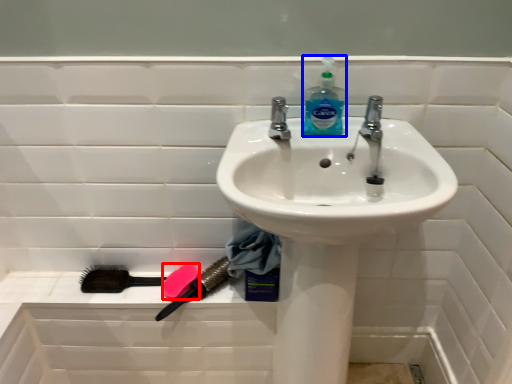
Question: Among these objects, which one is farthest to the camera, soap (highlighted by a red box) or cleaning product (highlighted by a blue box)?

Choices:
 (A) soap
 (B) cleaning product

Answer: (A)